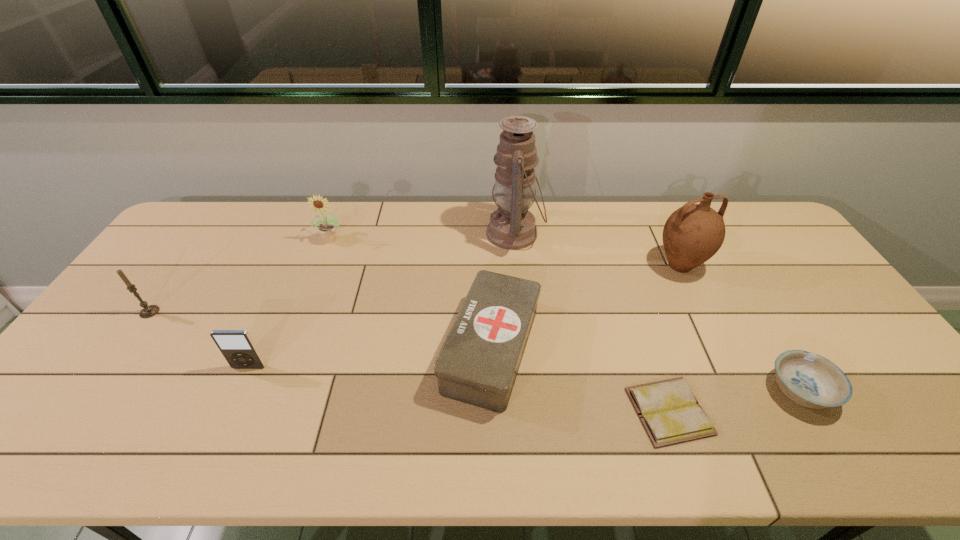
I want to click on the tallest object, so click(512, 226).

The height and width of the screenshot is (540, 960). Identify the location of the second tallest object. (692, 234).

At what (x,y) coordinates should I click in order to perform the action: click on sunflower. Please return your answer as a coordinate pair (x, y). Looking at the image, I should click on (327, 229).

In order to click on the leftmost object in this screenshot , I will do (x=148, y=311).

Where is `the fourth shortest object`? The width and height of the screenshot is (960, 540). the fourth shortest object is located at coordinates (237, 346).

Locate an element on the screen. This screenshot has width=960, height=540. the third shortest object is located at coordinates (478, 363).

Locate an element on the screen. the seventh tallest object is located at coordinates (811, 380).

Find the location of a particular element. The image size is (960, 540). the sixth object from left to right is located at coordinates (670, 413).

Find the location of a particular element. Image resolution: width=960 pixels, height=540 pixels. the shortest object is located at coordinates (670, 413).

This screenshot has height=540, width=960. In order to click on vacant region located 0.270m on the left of the oil lamp in this screenshot , I will do `click(408, 233)`.